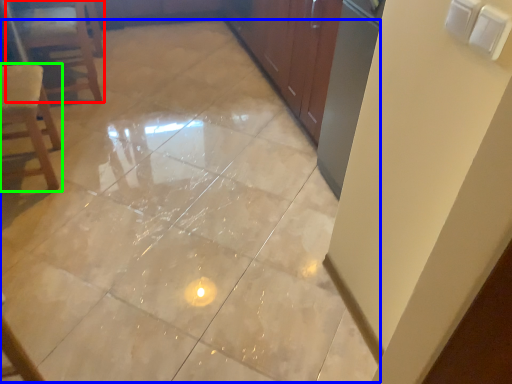
Question: Which is farther away from furniture (highlighted by a red box)? ceramic tile (highlighted by a blue box) or chair (highlighted by a green box)?

Choices:
 (A) ceramic tile
 (B) chair

Answer: (A)